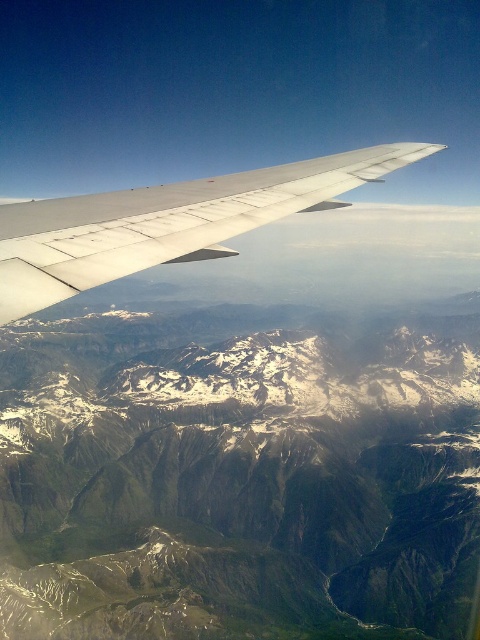
Question: Can you confirm if snowy rocky mountains at upper center is bigger than silver metallic wing at upper center?

Choices:
 (A) no
 (B) yes

Answer: (B)

Question: Which of the following is the closest to the observer?

Choices:
 (A) silver metallic wing at upper center
 (B) snowy rocky mountains at upper center

Answer: (A)

Question: Considering the relative positions of snowy rocky mountains at upper center and silver metallic wing at upper center in the image provided, where is snowy rocky mountains at upper center located with respect to silver metallic wing at upper center?

Choices:
 (A) left
 (B) right

Answer: (A)

Question: Is snowy rocky mountains at upper center to the left of silver metallic wing at upper center from the viewer's perspective?

Choices:
 (A) no
 (B) yes

Answer: (B)